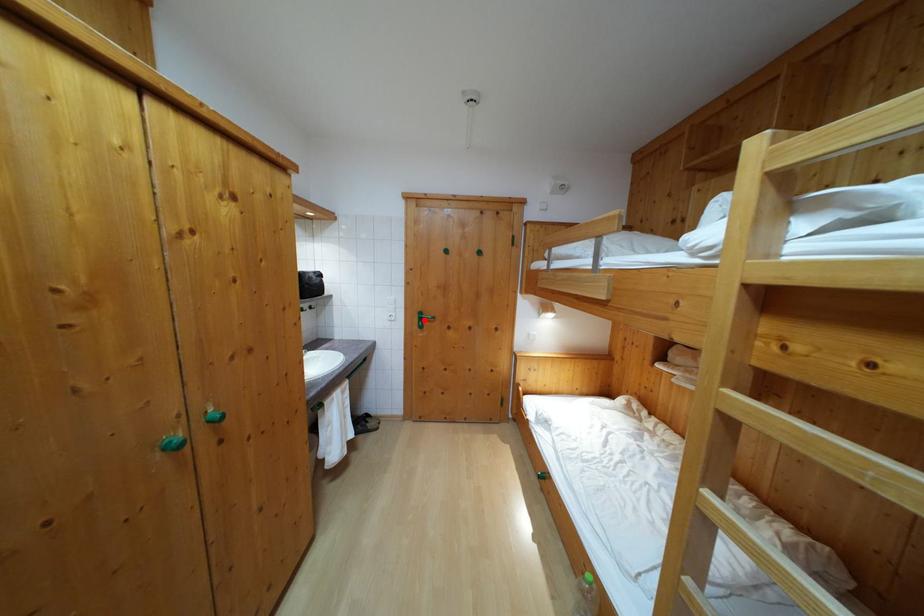
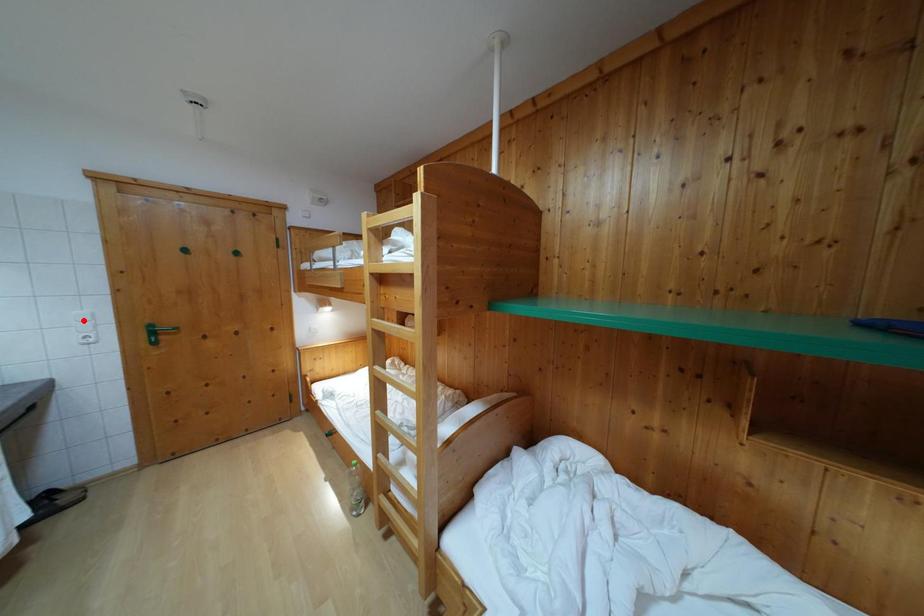
I am providing you with two images of the same scene from different viewpoints. A red point is marked on the first image and another point is marked on the second image. Is the red point in image1 aligned with the point shown in image2?

No